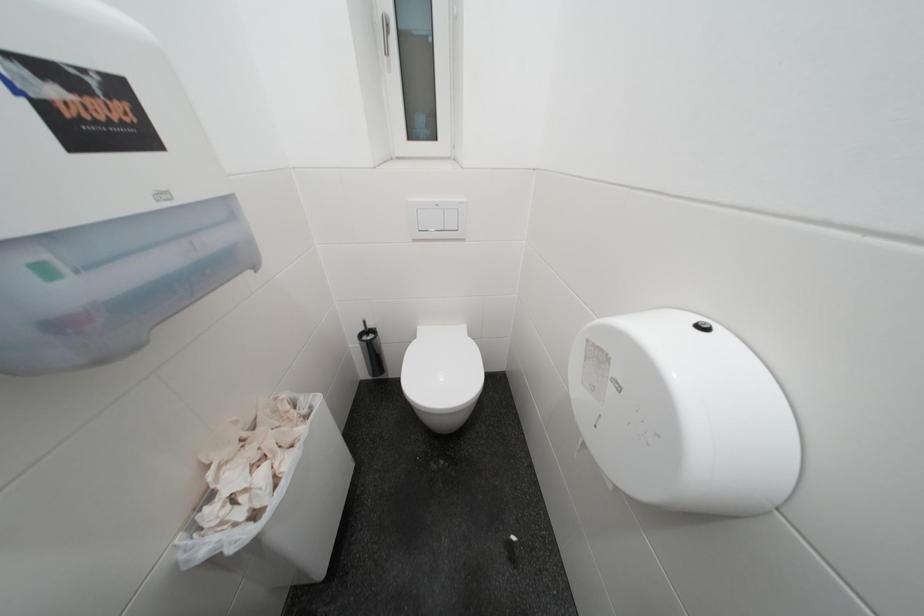
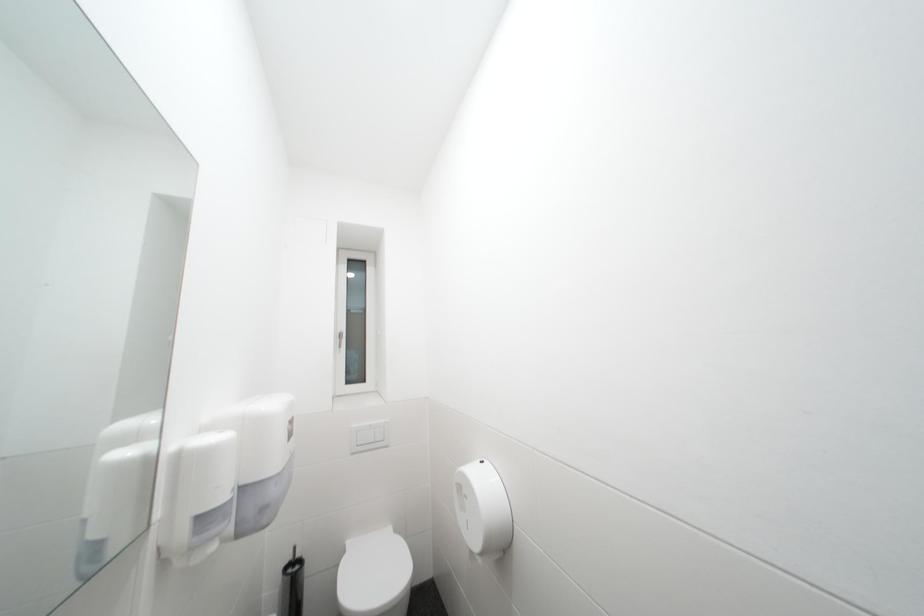
First-person continuous shooting, in which direction is the camera rotating?

The camera rotated toward right-up.